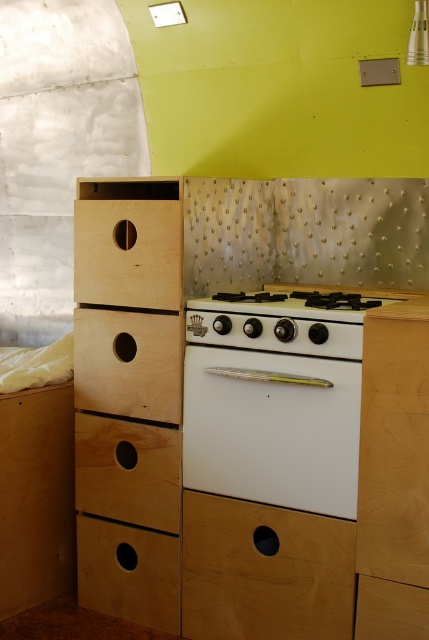
You are standing in the kitchenette and want to reach a point that is 2 meters away from you. Can you reach the point at coordinates point (199, 534)?

The point at coordinates point (199, 534) is 2.18 meters away from you, so you cannot reach it since it is further than 2 meters.

You are standing in the kitchenette and need to place a pot on the stove. The stove is at the center. Where is the natural wood dresser at left located relative to the stove?

The natural wood dresser at left is located to the left of the stove, positioned at coordinates point (247, 404) relative to the stove.

You need to place a large baking tray that requires a minimum of 50 cm in width. Based on the scene, which object between the white glossy oven at center and the light brown wood drawer at lower right can accommodate the tray?

The white glossy oven at center has a larger size compared to the light brown wood drawer at lower right, so the white glossy oven at center can accommodate the large baking tray requiring at least 50 cm in width.